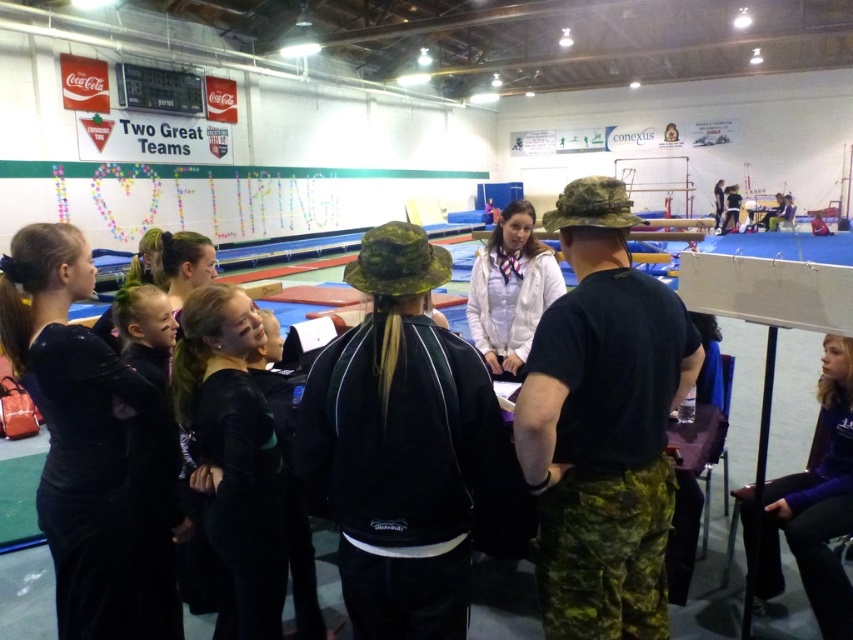
Question: Which point is closer to the camera taking this photo?

Choices:
 (A) (229, 452)
 (B) (544, 305)
 (C) (0, 328)

Answer: (A)

Question: Does black matte uniform at center appear over white fabric jacket at center?

Choices:
 (A) yes
 (B) no

Answer: (B)

Question: Which point appears closest to the camera in this image?

Choices:
 (A) (842, 456)
 (B) (213, 448)
 (C) (65, 529)
 (D) (529, 292)

Answer: (C)

Question: Can you confirm if purple fleece jacket at lower right is thinner than white fabric jacket at center?

Choices:
 (A) yes
 (B) no

Answer: (B)

Question: Which of the following is the closest to the observer?

Choices:
 (A) purple fleece jacket at lower right
 (B) black matte uniform at center
 (C) black velvet dress at center
 (D) white fabric jacket at center

Answer: (C)

Question: Is black matte uniform at center to the left of purple fleece jacket at lower right from the viewer's perspective?

Choices:
 (A) yes
 (B) no

Answer: (A)